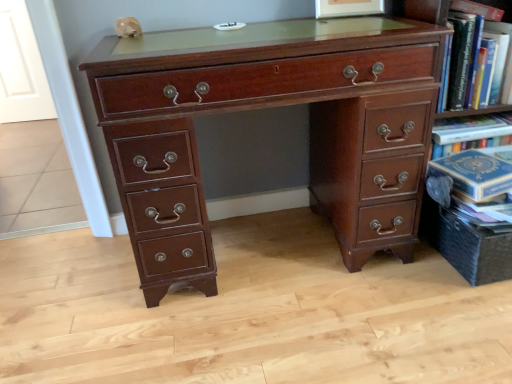
What do you see at coordinates (468, 50) in the screenshot? The width and height of the screenshot is (512, 384). I see `hardcover book at upper right` at bounding box center [468, 50].

You are a GUI agent. You are given a task and a screenshot of the screen. Output one action in this format:
    pyautogui.click(x=<x>, y=<y>)
    Task: Click on the hardcover book at upper right
    The image size is (512, 384).
    Given the screenshot: What is the action you would take?
    pyautogui.click(x=468, y=50)

You are a GUI agent. You are given a task and a screenshot of the screen. Output one action in this format:
    pyautogui.click(x=<x>, y=<y>)
    Task: Click on the mahogany wood desk at center
    
    Given the screenshot: What is the action you would take?
    pyautogui.click(x=264, y=107)

What do you see at coordinates (264, 107) in the screenshot? I see `mahogany wood desk at center` at bounding box center [264, 107].

You are a GUI agent. You are given a task and a screenshot of the screen. Output one action in this format:
    pyautogui.click(x=<x>, y=<y>)
    Task: Click on the hardcover book at upper right
    
    Given the screenshot: What is the action you would take?
    pyautogui.click(x=468, y=50)

Between mahogany wood desk at center and hardcover book at upper right, which one appears on the right side from the viewer's perspective?

From the viewer's perspective, hardcover book at upper right appears more on the right side.

Is the position of mahogany wood desk at center less distant than that of hardcover book at upper right?

Yes, mahogany wood desk at center is closer to the viewer.

Considering the positions of point (123, 101) and point (472, 1), is point (123, 101) closer or farther from the camera than point (472, 1)?

Point (123, 101).

From the image's perspective, between mahogany wood desk at center and hardcover book at upper right, who is located below?

mahogany wood desk at center is shown below in the image.

From a real-world perspective, who is located higher, mahogany wood desk at center or hardcover book at upper right?

In real-world perspective, hardcover book at upper right is above.

Can you confirm if mahogany wood desk at center is wider than hardcover book at upper right?

Yes.

Does mahogany wood desk at center have a lesser height compared to hardcover book at upper right?

No.

Does mahogany wood desk at center have a larger size compared to hardcover book at upper right?

Yes, mahogany wood desk at center is bigger than hardcover book at upper right.

Is mahogany wood desk at center not inside hardcover book at upper right?

Yes, mahogany wood desk at center is not within hardcover book at upper right.

Is mahogany wood desk at center positioned far away from hardcover book at upper right?

Actually, mahogany wood desk at center and hardcover book at upper right are a little close together.

Could you tell me if mahogany wood desk at center is facing hardcover book at upper right?

No, mahogany wood desk at center does not turn towards hardcover book at upper right.

What's the angular difference between mahogany wood desk at center and hardcover book at upper right's facing directions?

The facing directions of mahogany wood desk at center and hardcover book at upper right are 0.0105 degrees apart.

How far apart are mahogany wood desk at center and hardcover book at upper right?

A distance of 21.39 inches exists between mahogany wood desk at center and hardcover book at upper right.

The width and height of the screenshot is (512, 384). I want to click on the chest of drawers below the hardcover book at upper right (from the image's perspective), so click(264, 107).

In the image, is hardcover book at upper right on the left side or the right side of mahogany wood desk at center?

hardcover book at upper right is positioned on mahogany wood desk at center's right side.

Is hardcover book at upper right further to the viewer compared to mahogany wood desk at center?

Yes, the depth of hardcover book at upper right is greater than that of mahogany wood desk at center.

Does point (488, 2) come in front of point (203, 222)?

No, it is not.

From the picture: From the image's perspective, is hardcover book at upper right located above or below mahogany wood desk at center?

hardcover book at upper right is situated higher than mahogany wood desk at center in the image.

From a real-world perspective, is hardcover book at upper right positioned above or below mahogany wood desk at center?

In terms of real-world spatial position, hardcover book at upper right is above mahogany wood desk at center.

Between hardcover book at upper right and mahogany wood desk at center, which one has larger width?

mahogany wood desk at center is wider.

Considering the relative sizes of hardcover book at upper right and mahogany wood desk at center in the image provided, is hardcover book at upper right shorter than mahogany wood desk at center?

Yes.

Considering the relative sizes of hardcover book at upper right and mahogany wood desk at center in the image provided, is hardcover book at upper right smaller than mahogany wood desk at center?

Yes, hardcover book at upper right is smaller than mahogany wood desk at center.

Which is correct: hardcover book at upper right is inside mahogany wood desk at center, or outside of it?

hardcover book at upper right is spatially situated outside mahogany wood desk at center.

Are hardcover book at upper right and mahogany wood desk at center making contact?

No, hardcover book at upper right is not in contact with mahogany wood desk at center.

Is hardcover book at upper right facing towards mahogany wood desk at center?

No, hardcover book at upper right does not turn towards mahogany wood desk at center.

Can you tell me how much hardcover book at upper right and mahogany wood desk at center differ in facing direction?

There is a 0.0105-degree angle between the facing directions of hardcover book at upper right and mahogany wood desk at center.

You are a GUI agent. You are given a task and a screenshot of the screen. Output one action in this format:
    pyautogui.click(x=<x>, y=<y>)
    Task: Click on the chest of drawers on the left of the hardcover book at upper right
    
    Given the screenshot: What is the action you would take?
    pyautogui.click(x=264, y=107)

At what (x,y) coordinates should I click in order to perform the action: click on book lying behind the mahogany wood desk at center. Please return your answer as a coordinate pair (x, y). The width and height of the screenshot is (512, 384). Looking at the image, I should click on (468, 50).

Identify the location of chest of drawers located on the left of hardcover book at upper right. (264, 107).